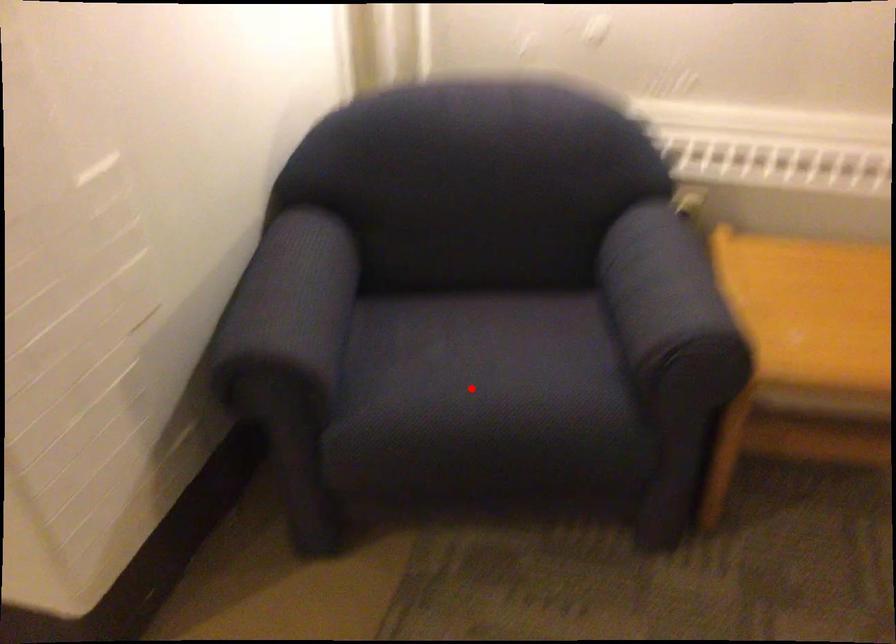
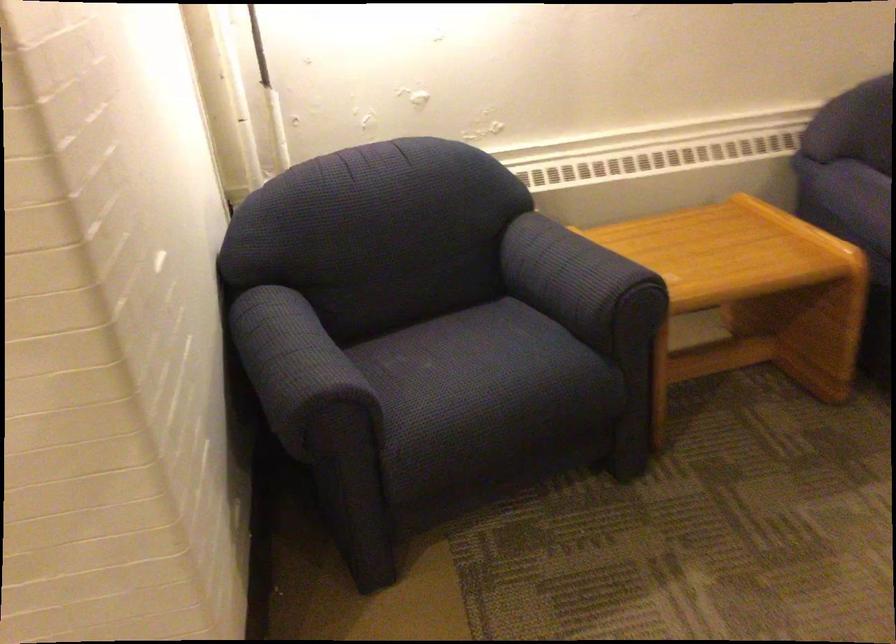
Locate, in the second image, the point that corresponds to the highlighted location in the first image.

(487, 377)